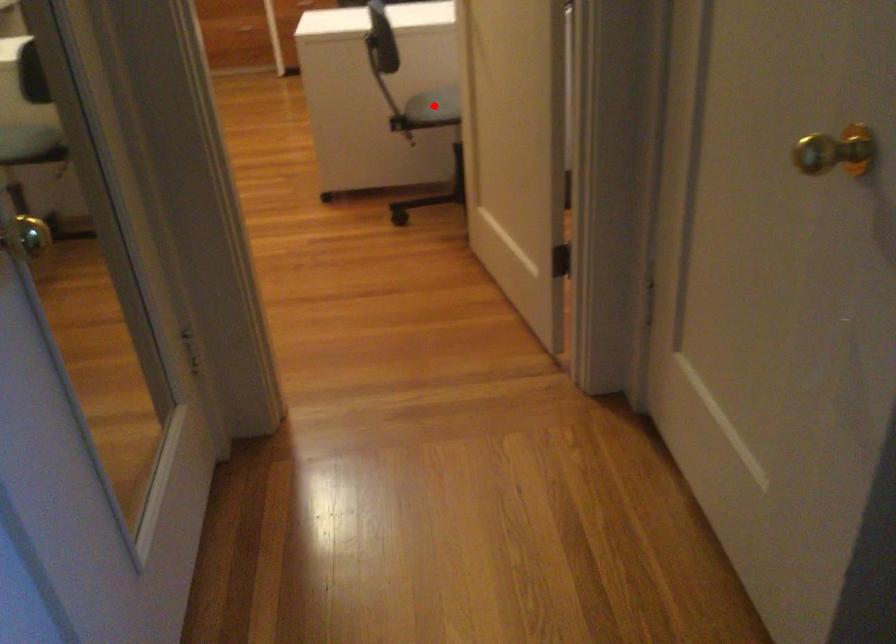
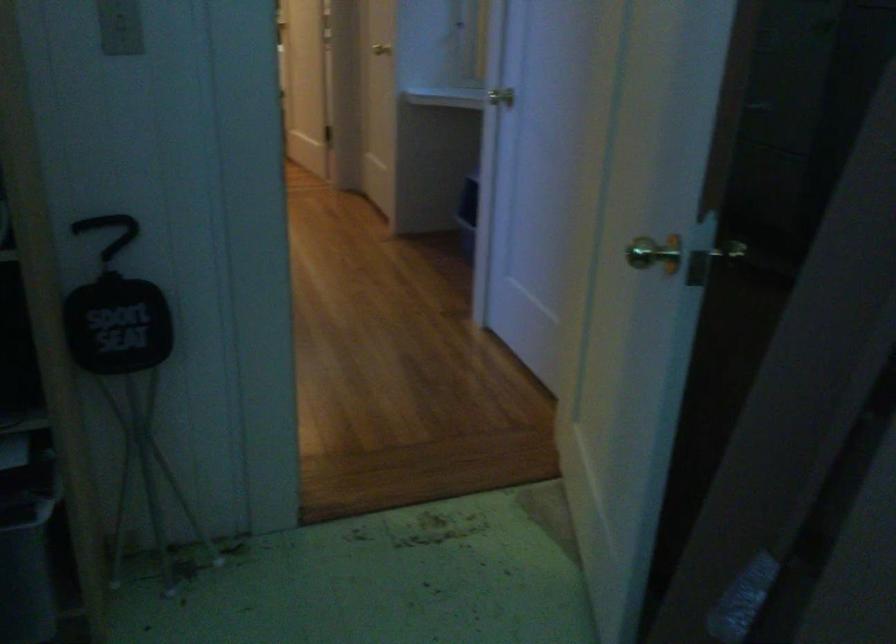
Question: I am providing you with two images of the same scene from different viewpoints. A red point is marked on the first image. Can you still see the location of the red point in image 2?

Choices:
 (A) Yes
 (B) No

Answer: (B)